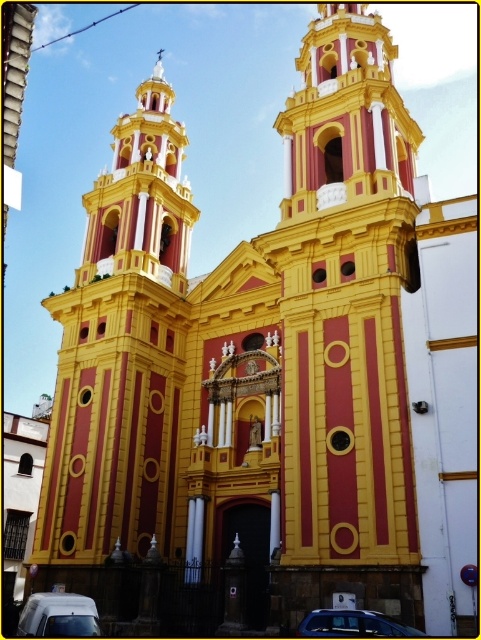
You are driving a delivery truck that is 15 meters long and need to park between the white matte van at lower left and the metallic blue car at lower center. Is there enough space between them for your truck?

The distance between the white matte van at lower left and the metallic blue car at lower center is 15.11 meters, so there is just enough space for the delivery truck that is 15 meters long to fit between them.

You are a photographer planning to capture the church facade. You have a white matte van at lower left and a metallic blue car at lower center in your shot. Which vehicle should you position closer to the entrance to ensure both fit in the frame without overlapping?

The white matte van at lower left is bigger than the metallic blue car at lower center, so you should position the metallic blue car at lower center closer to the entrance to accommodate the larger van behind it.

You are standing at the entrance of the church and want to take a photo of the ornate facade. However, there is a white matte van at lower left blocking your view. Where is the white matte van located in relation to the church facade?

The white matte van at lower left is located at the lower left corner of the church facade, specifically at coordinate point (59,616), which is blocking the view from the entrance.